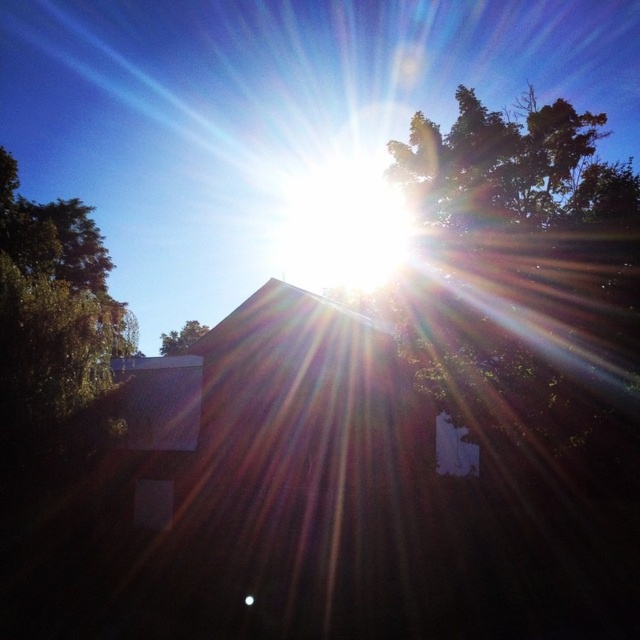
Does point (61, 262) lie in front of point (179, 348)?

Yes, it is in front of point (179, 348).

Describe the element at coordinates (52, 308) in the screenshot. This screenshot has height=640, width=640. I see `green leafy tree at left` at that location.

What do you see at coordinates (52, 308) in the screenshot? I see `green leafy tree at left` at bounding box center [52, 308].

Locate an element on the screen. This screenshot has height=640, width=640. green leafy tree at left is located at coordinates (52, 308).

Describe the element at coordinates (531, 205) in the screenshot. I see `green leafy tree at upper right` at that location.

Can you confirm if green leafy tree at upper right is taller than green leafy tree at center?

Correct, green leafy tree at upper right is much taller as green leafy tree at center.

Between point (449, 212) and point (164, 340), which one is positioned behind?

Positioned behind is point (164, 340).

Locate an element on the screen. The image size is (640, 640). green leafy tree at upper right is located at coordinates (531, 205).

Between green leafy tree at upper right and green leafy tree at left, which one appears on the right side from the viewer's perspective?

From the viewer's perspective, green leafy tree at upper right appears more on the right side.

Is point (435, 376) less distant than point (56, 260)?

That is True.

Does point (492, 221) come in front of point (26, 296)?

Yes, it is in front of point (26, 296).

Identify the location of green leafy tree at upper right. (531, 205).